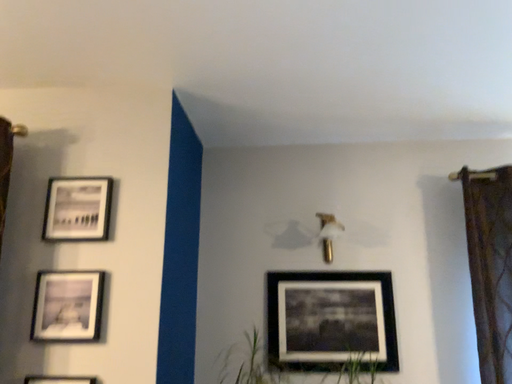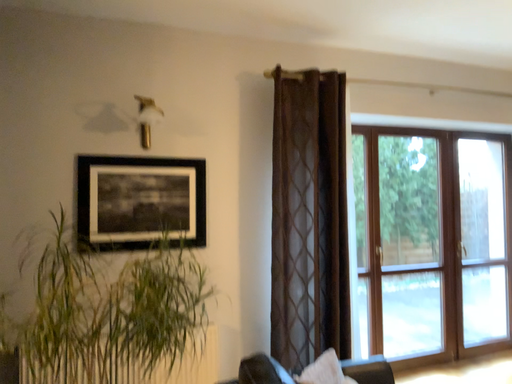
Question: Which way did the camera rotate in the video?

Choices:
 (A) rotated upward
 (B) rotated downward

Answer: (B)